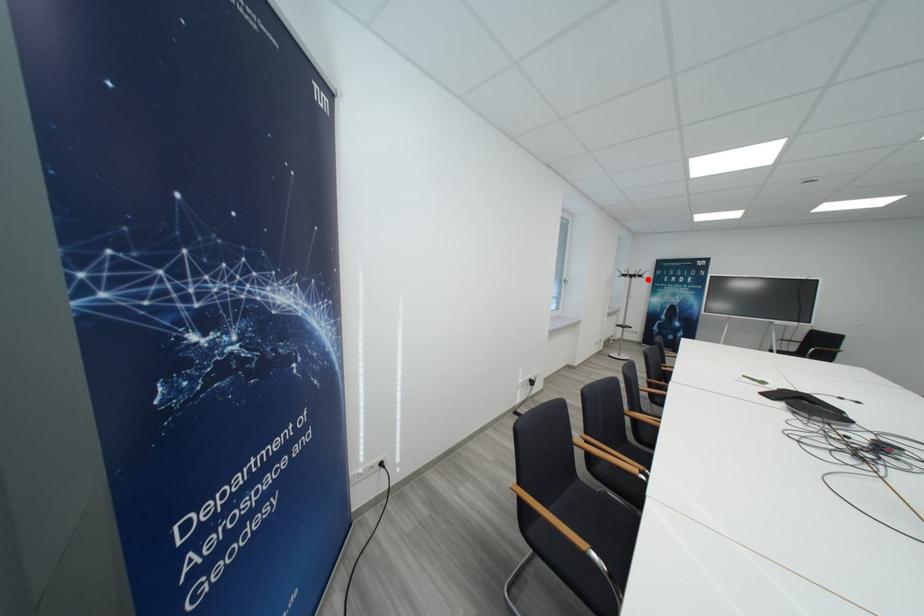
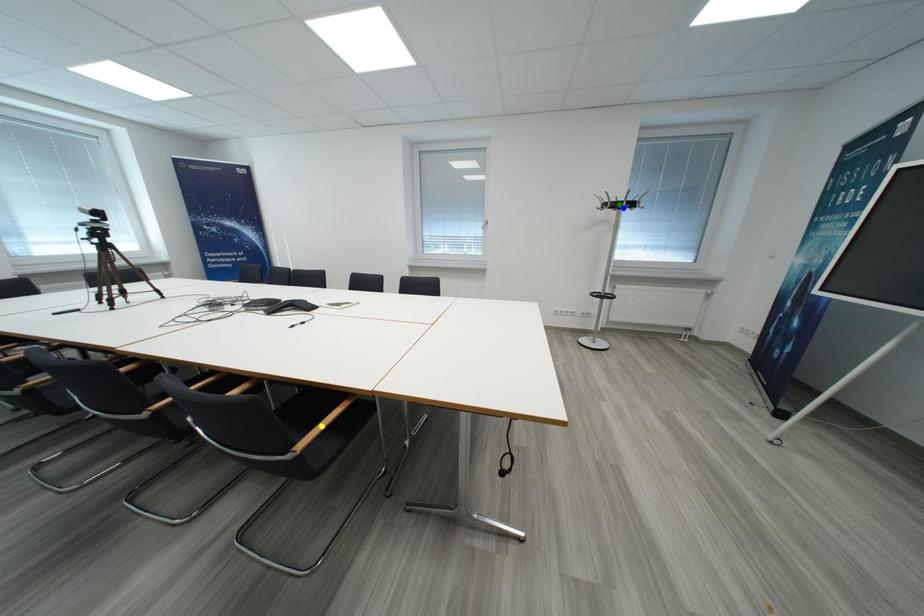
Question: I am providing you with two images of the same scene from different viewpoints. A red point is marked on the first image. You are given multiple points on the second image. In image 2, which mark is for the same physical point as the one in image 1?

Choices:
 (A) yellow point
 (B) green point
 (C) blue point

Answer: (C)